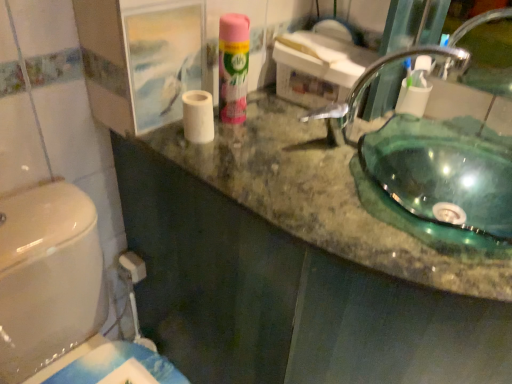
I want to click on free space to the left of transparent glass sink at upper right, so click(275, 155).